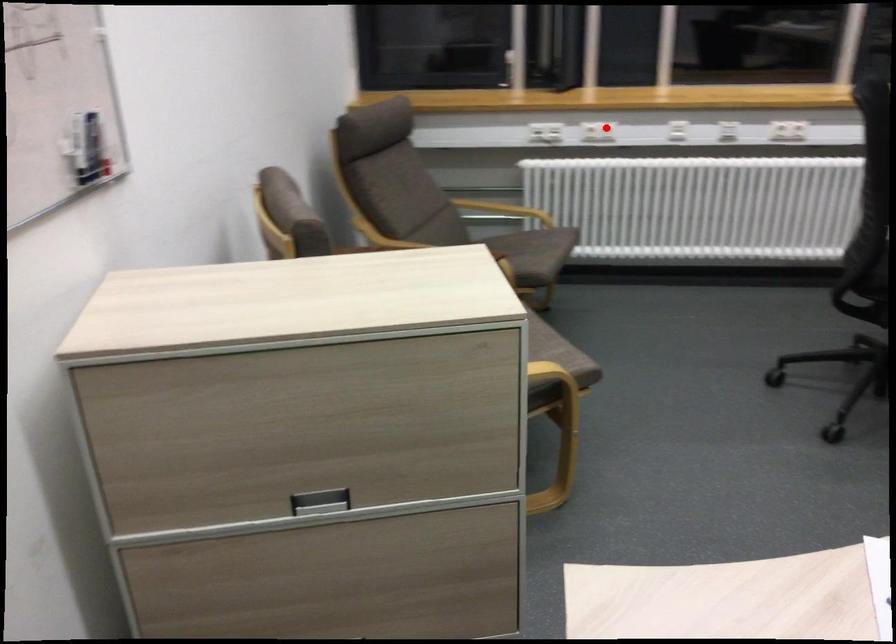
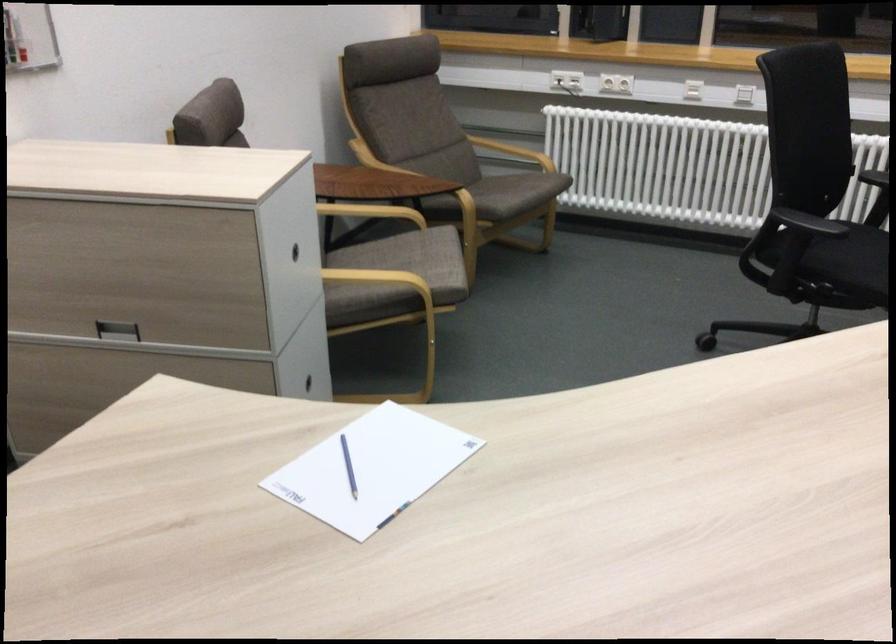
In the second image, find the point that corresponds to the highlighted location in the first image.

(616, 82)